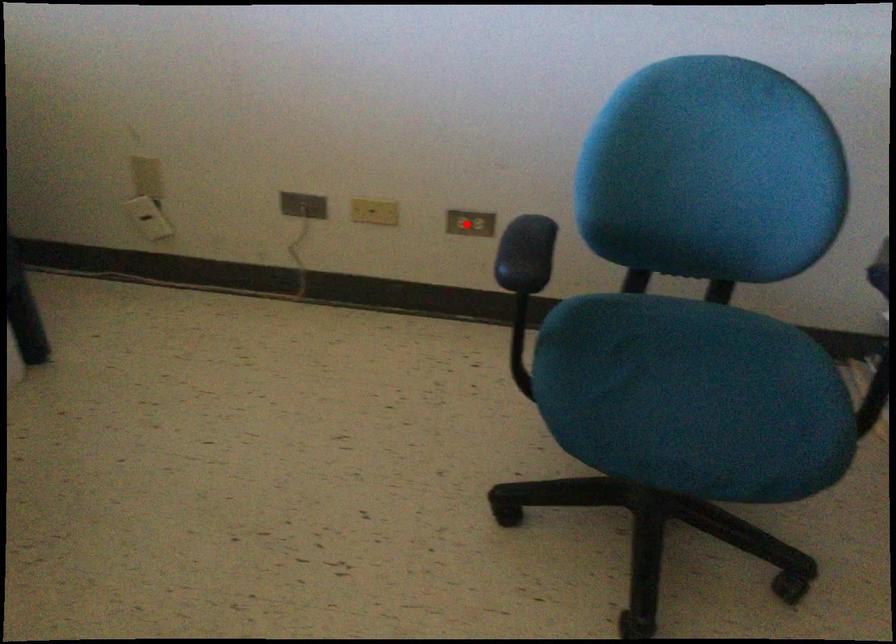
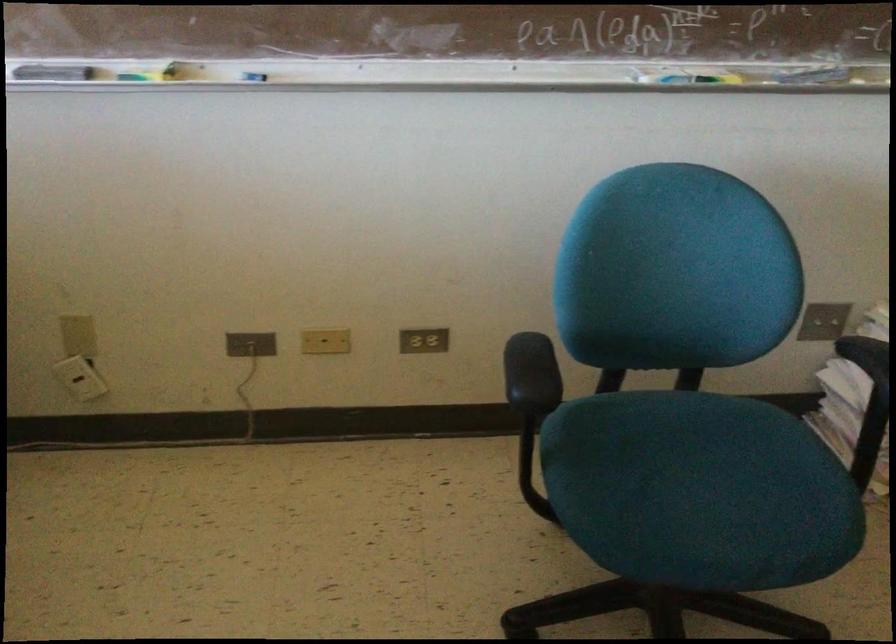
Where in the second image is the point corresponding to the highlighted location from the first image?

(423, 341)